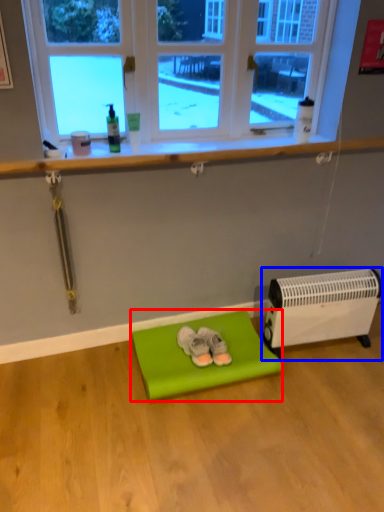
Question: Which object is further to the camera taking this photo, furniture (highlighted by a red box) or heater (highlighted by a blue box)?

Choices:
 (A) furniture
 (B) heater

Answer: (B)